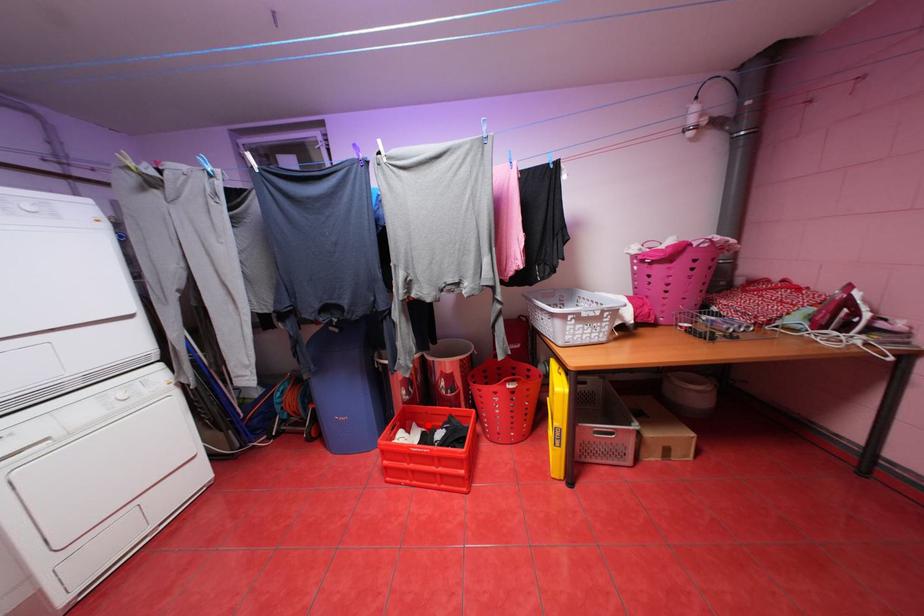
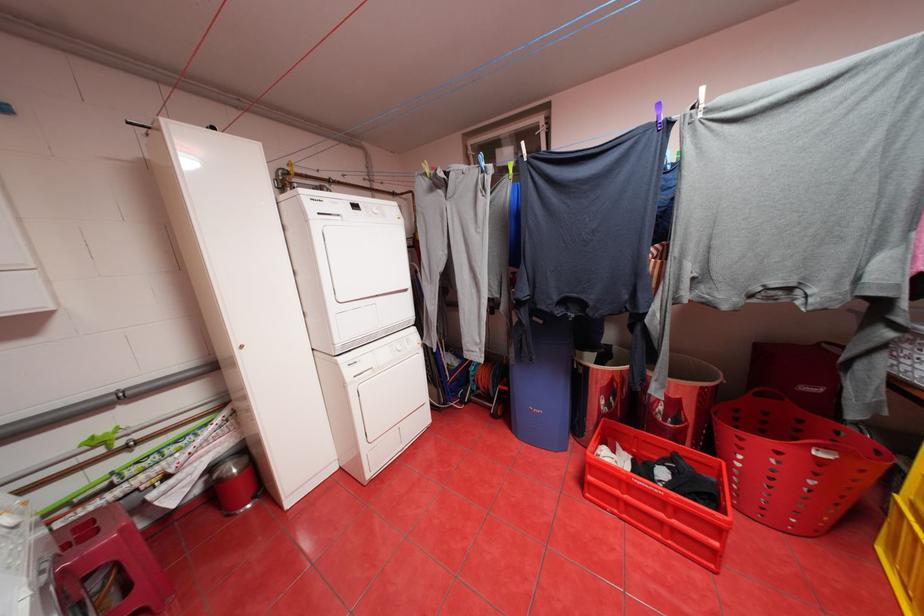
Question: I am providing you with two images of the same scene from different viewpoints. A red point is shown in image1. For the corresponding object point in image2, is it positioned nearer or farther from the camera?

Choices:
 (A) Nearer
 (B) Farther

Answer: (A)